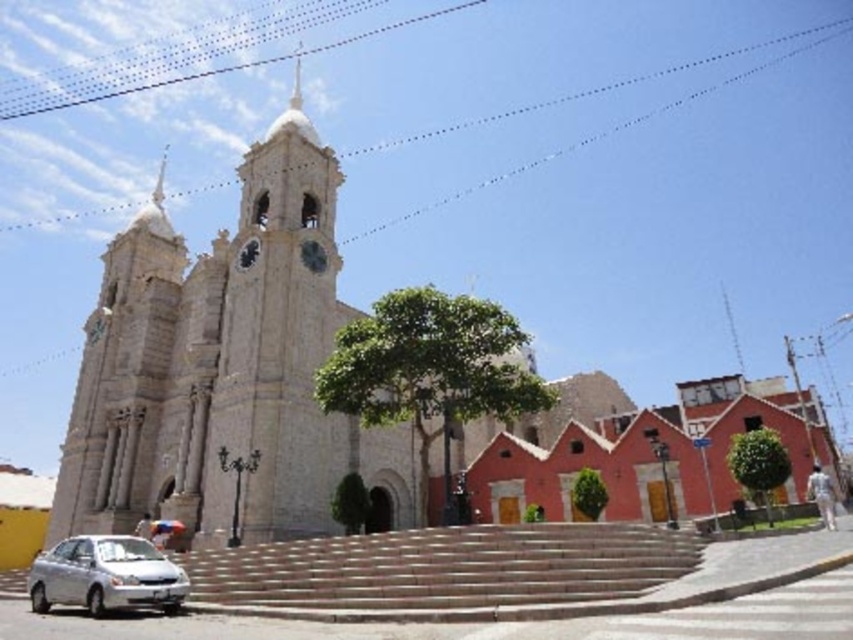
You are a delivery person who needs to park your silver metallic car at lower left as close as possible to the smooth stone stairs at center. According to the image, how far apart are they?

The smooth stone stairs at center and silver metallic car at lower left are 11.14 meters apart from each other.

You are standing at the base of the smooth stone stairs at center and want to walk towards the silver metallic car at lower left. Which direction should you head?

You should head towards the silver metallic car at lower left because the smooth stone stairs at center is closer to the viewer than the silver metallic car at lower left, so moving towards the car would mean going away from the stairs. Wait, that seems contradictory. Let me think again. If the stairs are closer, then the car is further away. So to reach the car from the stairs, you need to move in the direction away from the viewer, but since you are at the base of the stairs, maybe you need to go left? Or